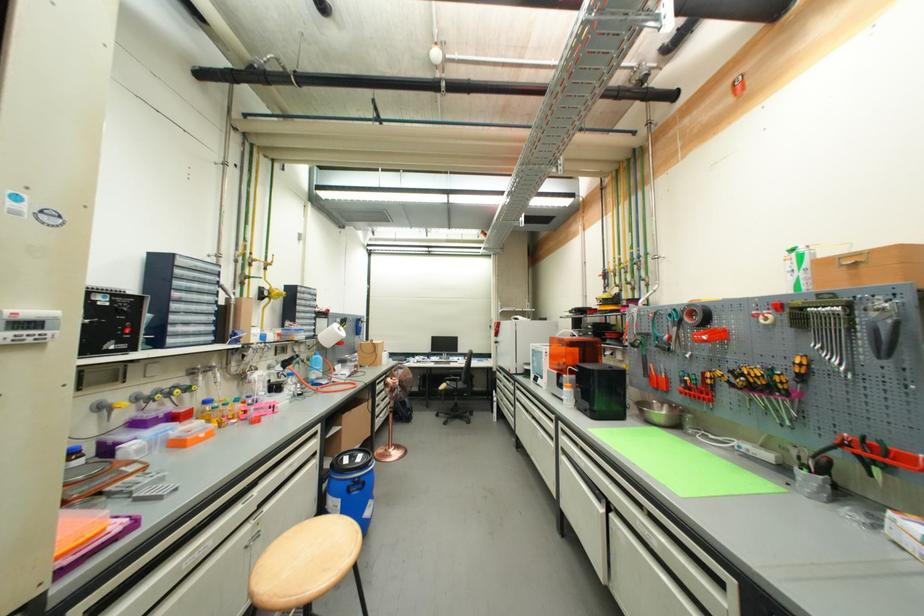
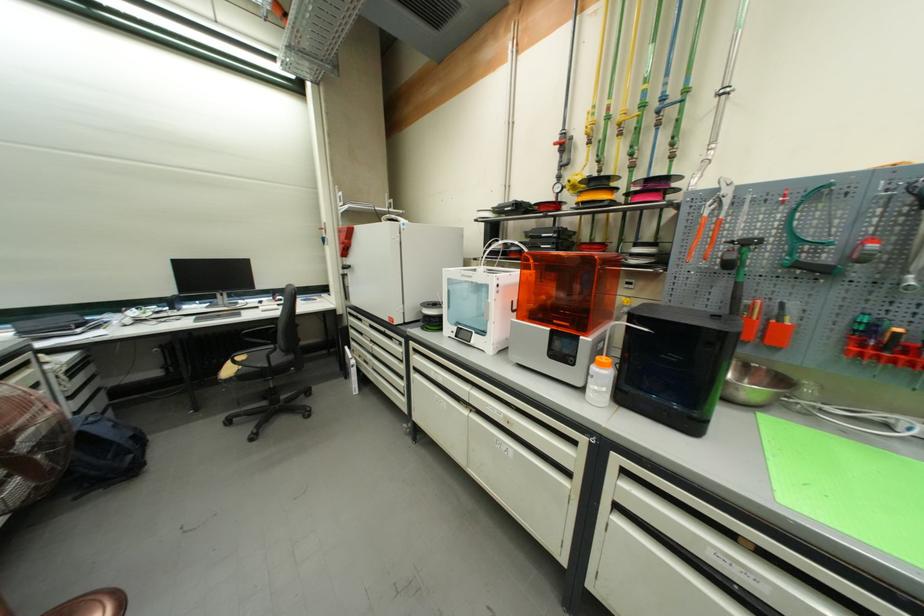
In the second image, find the point that corresponds to point 636,318 in the first image.

(719, 208)